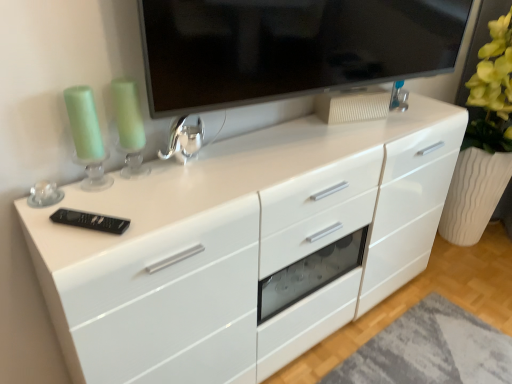
At what (x,y) coordinates should I click in order to perform the action: click on vacant space behind black plastic remote at lower left, positioned as the second appliance in back-to-front order. Please return your answer as a coordinate pair (x, y). Looking at the image, I should click on (115, 196).